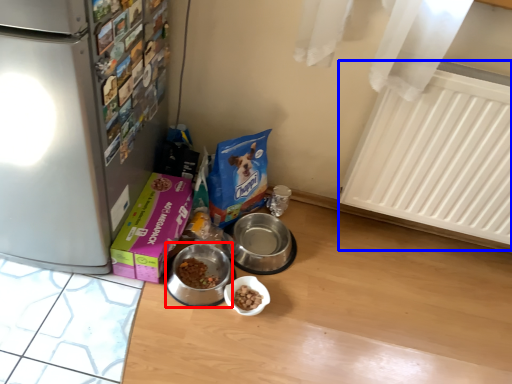
Question: Among these objects, which one is nearest to the camera, appliance (highlighted by a red box) or radiator (highlighted by a blue box)?

Choices:
 (A) appliance
 (B) radiator

Answer: (B)